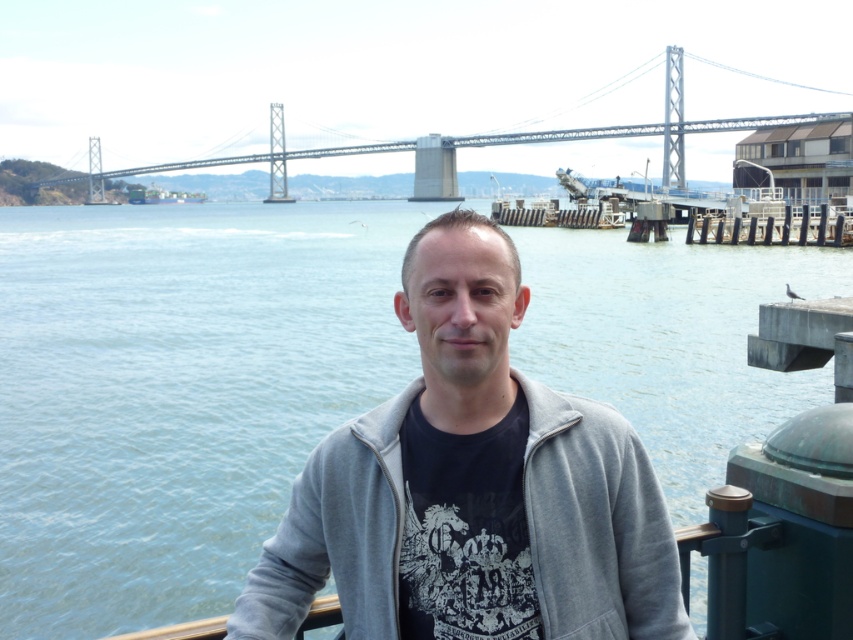
Measure the distance from gray fleece jacket at center to metallic gray bridge at upper center.

gray fleece jacket at center and metallic gray bridge at upper center are 126.39 meters apart from each other.

The image size is (853, 640). What do you see at coordinates (473, 486) in the screenshot? I see `gray fleece jacket at center` at bounding box center [473, 486].

Is point (625, 522) behind point (579, 140)?

No, it is in front of (579, 140).

Where is `gray fleece jacket at center`? gray fleece jacket at center is located at coordinates (473, 486).